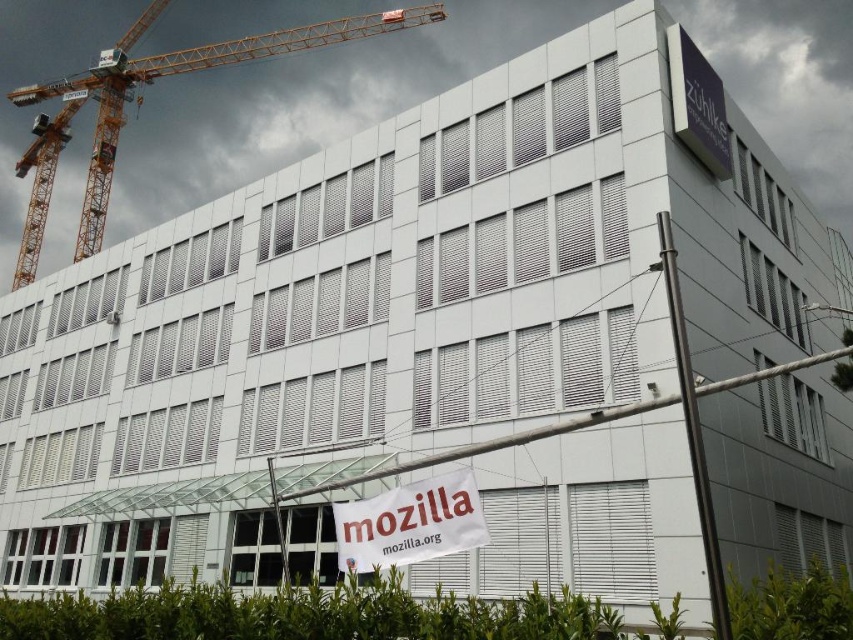
From the picture: You are a construction worker standing at the base of the yellow metal crane at upper left. You want to hang a new sign on the white fabric banner at center. Can you reach the banner without moving the crane?

The white fabric banner at center is behind the yellow metal crane at upper left, so you cannot reach it from your current position at the base of the crane. You would need to move around the crane or use another method to access the banner.